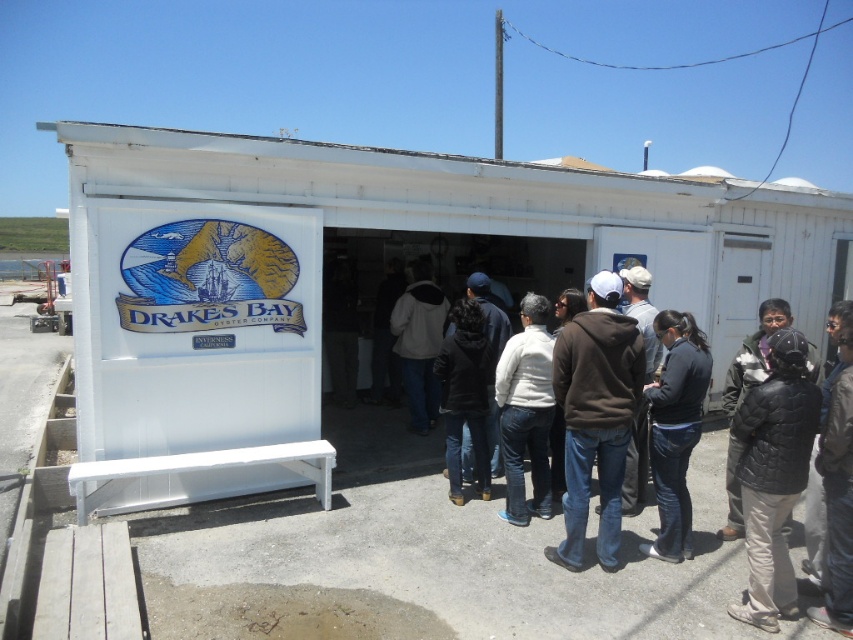
You are a photographer trying to capture the white painted wood shed at center and the brown hoodie at center in a single frame. Based on their positions, which object should you focus on first to ensure both are in the frame?

The white painted wood shed at center is in front of the brown hoodie at center, so you should focus on the white painted wood shed at center first to ensure both are in the frame.

You are a photographer trying to capture the white painted wood shed at center and the denim jeans at center in a single shot. Based on their positions, which object should you focus on first to ensure both are in frame?

The white painted wood shed at center is in front of denim jeans at center, so you should focus on the white painted wood shed at center first to ensure both are in frame.